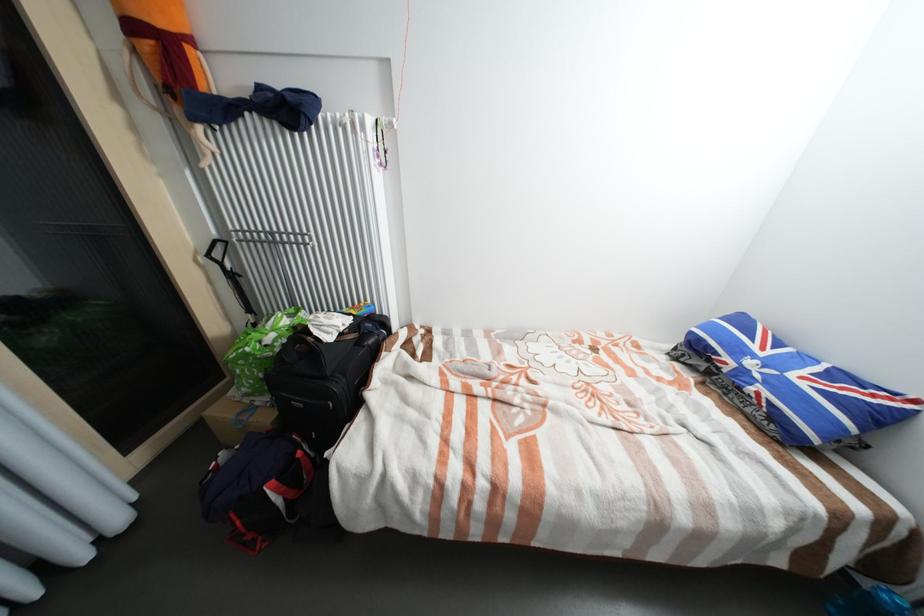
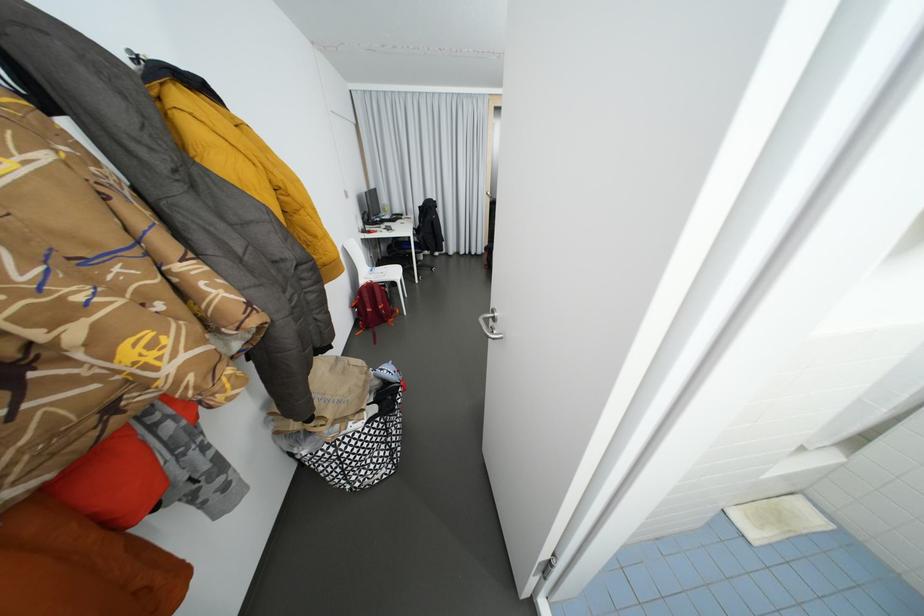
Question: I am providing you with two images of the same scene from different viewpoints. Which of the following objects are not visible in image2?

Choices:
 (A) black luggage handle
 (B) white dispenser lever
 (C) white chair sitting surface
 (D) red backpack

Answer: (A)